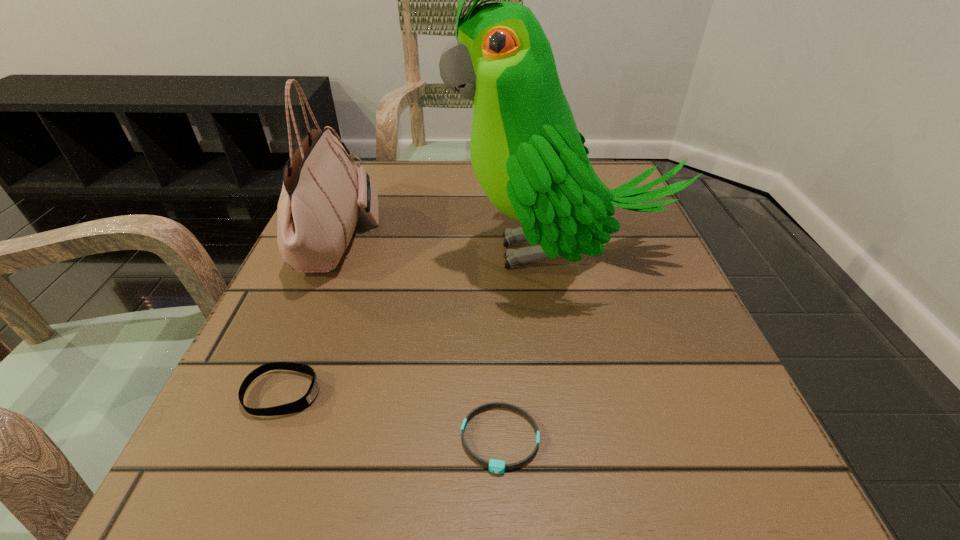
The width and height of the screenshot is (960, 540). Find the location of `the tallest object`. the tallest object is located at coordinates (530, 159).

Locate an element on the screen. The height and width of the screenshot is (540, 960). the third shortest object is located at coordinates (322, 194).

Identify the location of the taller wristband. The image size is (960, 540). (301, 404).

At what (x,y) coordinates should I click in order to perform the action: click on the left wristband. Please return your answer as a coordinate pair (x, y). The image size is (960, 540). Looking at the image, I should click on (301, 404).

What are the coordinates of `the right wristband` in the screenshot? It's located at (495, 466).

I want to click on the shorter wristband, so click(x=495, y=466).

This screenshot has height=540, width=960. In order to click on free spot located 0.270m on the beak of the parakeet in this screenshot , I will do `click(309, 253)`.

Identify the location of free space located 0.190m on the beak of the parakeet. (350, 253).

Where is `vacant space located 0.190m on the beak of the parakeet`? The width and height of the screenshot is (960, 540). vacant space located 0.190m on the beak of the parakeet is located at coordinates (350, 253).

Locate an element on the screen. free point located on the side of the handbag with the attached pouch is located at coordinates (561, 239).